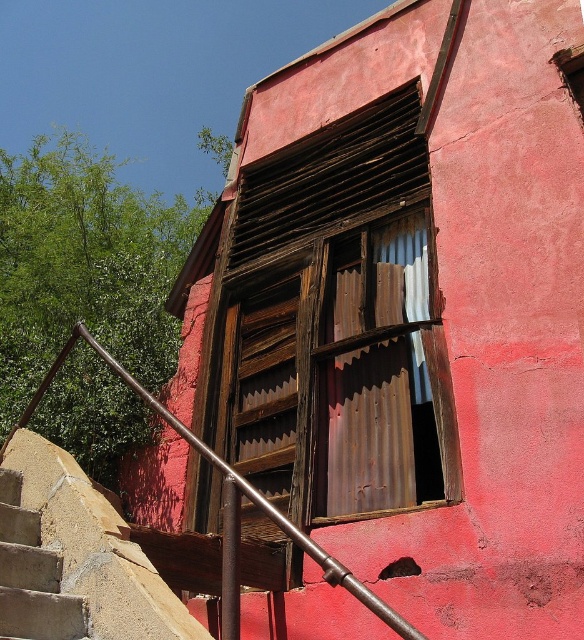
Measure the distance between point (103, 355) and camera.

They are 20.73 feet apart.

This screenshot has height=640, width=584. What are the coordinates of `brown metal/rustic handrail at lower left` in the screenshot? It's located at (231, 508).

Identify the location of brown metal/rustic handrail at lower left. (231, 508).

Who is more forward, (x=318, y=502) or (x=380, y=614)?

Positioned in front is point (x=380, y=614).

Can you confirm if rusty metal window at center is taller than brown metal/rustic handrail at lower left?

Yes.

You are a GUI agent. You are given a task and a screenshot of the screen. Output one action in this format:
    pyautogui.click(x=<x>, y=<y>)
    Task: Click on the rusty metal window at center
    The image size is (584, 640).
    Given the screenshot: What is the action you would take?
    pyautogui.click(x=332, y=324)

Does rusty metal window at center have a greater height compared to smooth concrete steps at lower left?

Yes, rusty metal window at center is taller than smooth concrete steps at lower left.

Image resolution: width=584 pixels, height=640 pixels. Describe the element at coordinates (332, 324) in the screenshot. I see `rusty metal window at center` at that location.

Where is `rusty metal window at center`? This screenshot has height=640, width=584. rusty metal window at center is located at coordinates (332, 324).

The image size is (584, 640). Identify the location of rusty metal window at center. (332, 324).